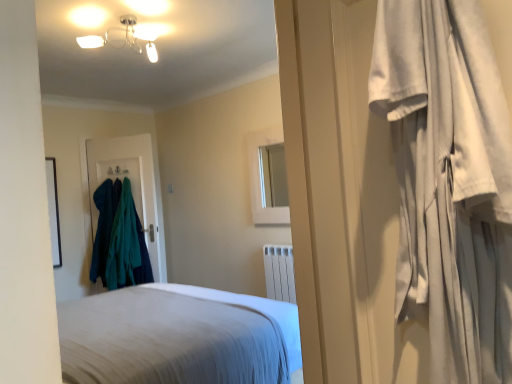
Question: Is the surface of metallic glass chandelier at upper center in direct contact with white soft bed at center, marked as the second bed in a bottom-to-top arrangement?

Choices:
 (A) yes
 (B) no

Answer: (B)

Question: Would you say metallic glass chandelier at upper center contains white soft bed at center, which is counted as the second bed, starting from the back?

Choices:
 (A) no
 (B) yes

Answer: (A)

Question: Does metallic glass chandelier at upper center come behind white soft bed at center, marked as the second bed in a bottom-to-top arrangement?

Choices:
 (A) yes
 (B) no

Answer: (A)

Question: Is metallic glass chandelier at upper center outside of white soft bed at center, the 1th bed positioned from the front?

Choices:
 (A) yes
 (B) no

Answer: (A)

Question: Is metallic glass chandelier at upper center facing towards white soft bed at center, the 1th bed positioned from the front?

Choices:
 (A) no
 (B) yes

Answer: (A)

Question: Do you think teal fabric coat at left, the 2th clothing viewed from the right, is within white cotton curtain at right, or outside of it?

Choices:
 (A) outside
 (B) inside

Answer: (A)

Question: From the image's perspective, is teal fabric coat at left, the 2th clothing viewed from the right, above or below white cotton curtain at right?

Choices:
 (A) above
 (B) below

Answer: (B)

Question: From a real-world perspective, is teal fabric coat at left, which ranks as the 1th clothing in left-to-right order, above or below white cotton curtain at right?

Choices:
 (A) above
 (B) below

Answer: (B)

Question: In the image, is teal fabric coat at left, the 2th clothing viewed from the right, on the left side or the right side of white cotton curtain at right?

Choices:
 (A) right
 (B) left

Answer: (B)

Question: From their relative heights in the image, would you say white glossy medicine cabinet at upper center is taller or shorter than teal fabric coat hanger at left?

Choices:
 (A) short
 (B) tall

Answer: (A)

Question: Considering the positions of white glossy medicine cabinet at upper center and teal fabric coat hanger at left in the image, is white glossy medicine cabinet at upper center bigger or smaller than teal fabric coat hanger at left?

Choices:
 (A) big
 (B) small

Answer: (B)

Question: Does point (258, 198) appear closer or farther from the camera than point (110, 162)?

Choices:
 (A) farther
 (B) closer

Answer: (B)

Question: Based on their positions, is white glossy medicine cabinet at upper center located to the left or right of teal fabric coat hanger at left?

Choices:
 (A) left
 (B) right

Answer: (B)

Question: Would you say white soft bed at center, the 1th bed positioned from the front, is to the left or to the right of metallic glass chandelier at upper center in the picture?

Choices:
 (A) right
 (B) left

Answer: (A)

Question: Considering the positions of white soft bed at center, which is counted as the second bed, starting from the back, and metallic glass chandelier at upper center in the image, is white soft bed at center, which is counted as the second bed, starting from the back, wider or thinner than metallic glass chandelier at upper center?

Choices:
 (A) thin
 (B) wide

Answer: (A)